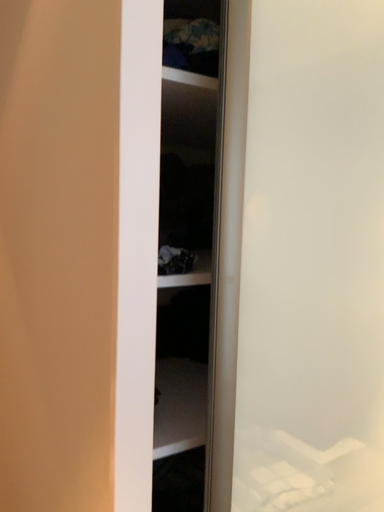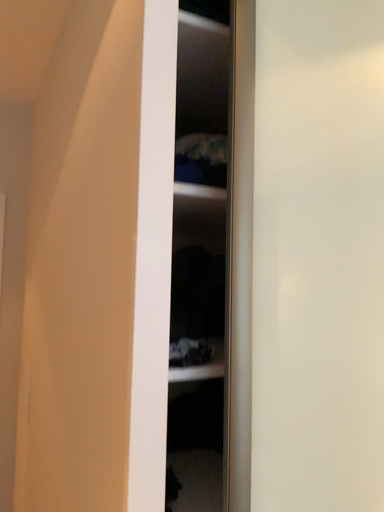
Question: Which way did the camera rotate in the video?

Choices:
 (A) rotated downward
 (B) rotated upward

Answer: (B)